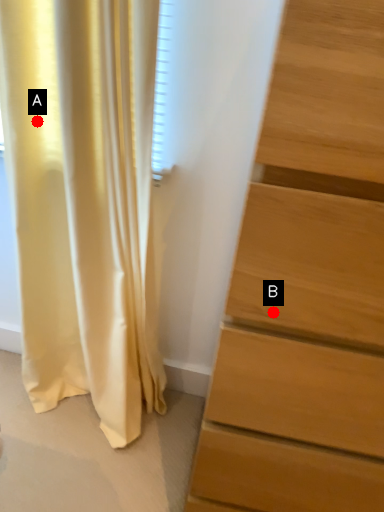
Question: Two points are circled on the image, labeled by A and B beside each circle. Which point is closer to the camera?

Choices:
 (A) A is closer
 (B) B is closer

Answer: (B)